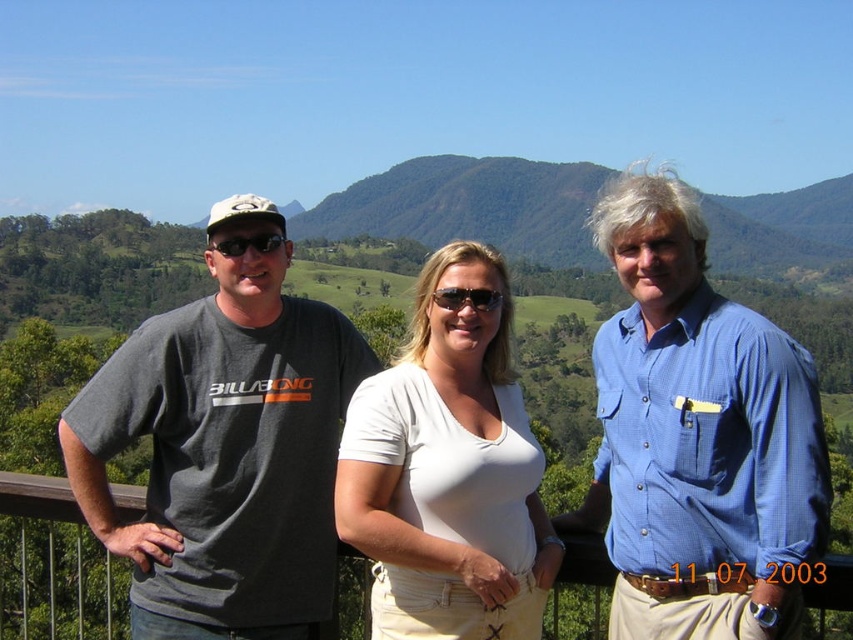
Question: Which object is closer to the camera taking this photo?

Choices:
 (A) gray cotton t-shirt at left
 (B) sunglasses at center
 (C) black plastic sunglasses at center

Answer: (A)

Question: Does gray cotton t-shirt at left appear on the right side of white cotton shirt at center?

Choices:
 (A) yes
 (B) no

Answer: (A)

Question: Considering the relative positions of dark gray t-shirt at left and blue textured shirt at center in the image provided, where is dark gray t-shirt at left located with respect to blue textured shirt at center?

Choices:
 (A) above
 (B) below

Answer: (B)

Question: Which object is positioned closest to the gray cotton t-shirt at left?

Choices:
 (A) black plastic sunglasses at center
 (B) dark gray t-shirt at left

Answer: (A)

Question: Can you confirm if dark gray t-shirt at left is bigger than sunglasses at center?

Choices:
 (A) yes
 (B) no

Answer: (A)

Question: Which object is the closest to the black plastic sunglasses at center?

Choices:
 (A) dark gray t-shirt at left
 (B) blue textured shirt at center

Answer: (A)